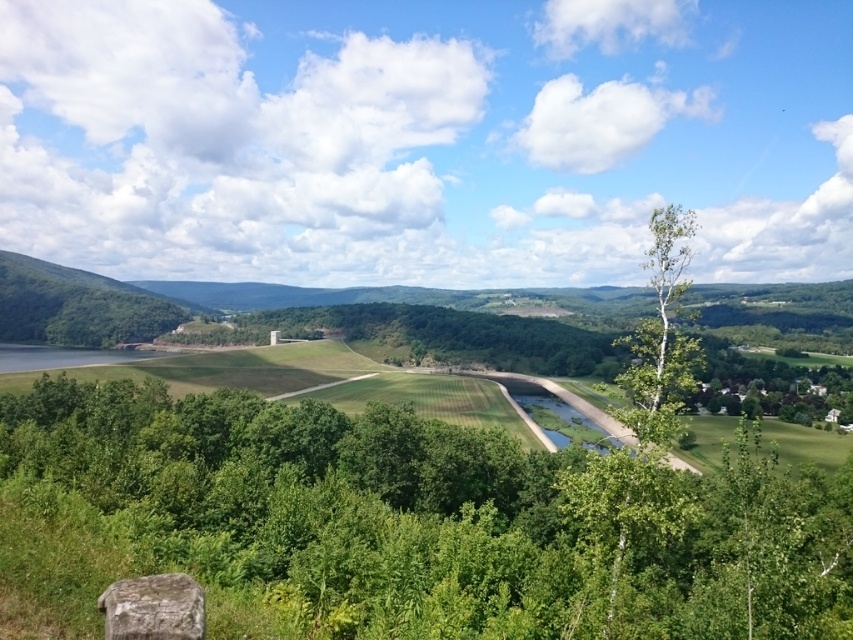
You are a bird flying over the rural landscape. You see the green leafy tree at left and the white smooth tree at right. Which tree would you land on first if you are following the river from its starting point?

The green leafy tree at left is positioned over the white smooth tree at right, so if you are following the river from its starting point, you would reach the green leafy tree at left first before the white smooth tree at right.

You are standing at the center of the image and want to locate the green leafy tree at left. In which direction should you look to find it?

The green leafy tree at left is located at point 0.480 on the x axis and 0.090 on the y axis. Since you are at the center, you should look to the left to find it.